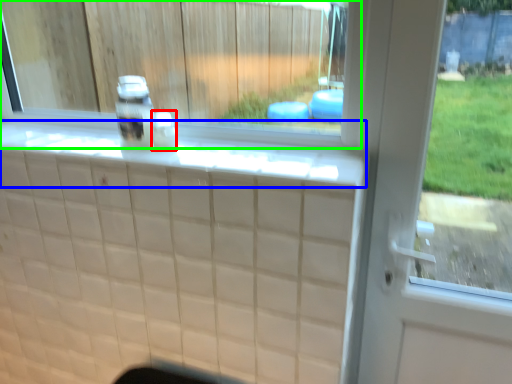
Question: Based on their relative distances, which object is farther from bottle (highlighted by a red box)? Choose from ledge (highlighted by a blue box) and window (highlighted by a green box).

Choices:
 (A) ledge
 (B) window

Answer: (B)